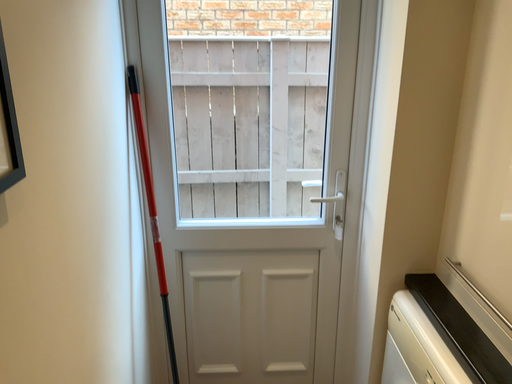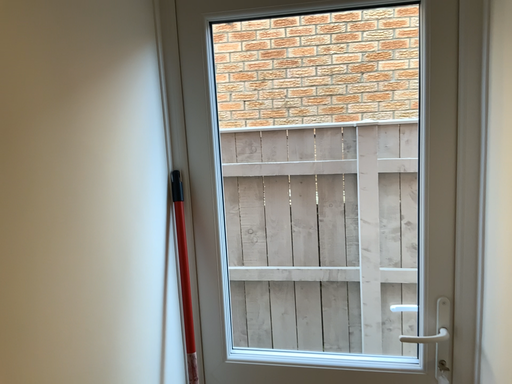
Question: Which way did the camera rotate in the video?

Choices:
 (A) rotated left
 (B) rotated right

Answer: (A)